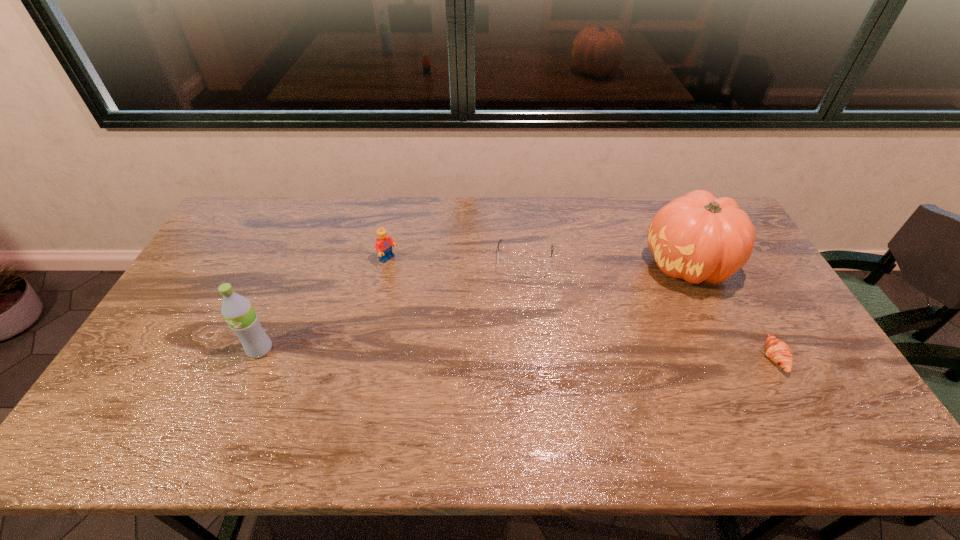
Where is `vacant area in the image that satisfies the following two spatial constraints: 1. on the front side of the Lego; 2. on the left side of the pumpkin`? vacant area in the image that satisfies the following two spatial constraints: 1. on the front side of the Lego; 2. on the left side of the pumpkin is located at coordinates (389, 264).

Identify the location of vacant space that satisfies the following two spatial constraints: 1. on the front side of the shortest object; 2. on the front-facing side of the third object from left to right. (537, 357).

This screenshot has width=960, height=540. In order to click on vacant region that satisfies the following two spatial constraints: 1. on the front side of the shortest object; 2. on the front-facing side of the fourth tallest object in this screenshot , I will do (x=537, y=357).

Identify the location of free location that satisfies the following two spatial constraints: 1. on the front side of the shortest object; 2. on the front-facing side of the Lego. (369, 357).